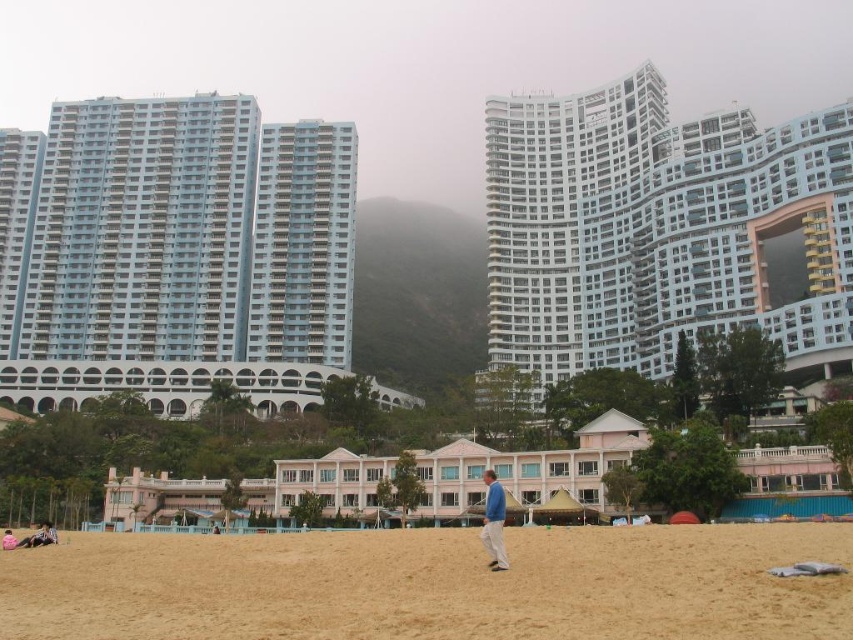
Is light blue glass building at left smaller than light blue fabric at lower left?

Actually, light blue glass building at left might be larger than light blue fabric at lower left.

Describe the element at coordinates (189, 236) in the screenshot. I see `light blue glass building at left` at that location.

Between point (129, 184) and point (4, 541), which one is positioned behind?

The point (129, 184) is more distant.

Where is `light blue glass building at left`? The image size is (853, 640). light blue glass building at left is located at coordinates (189, 236).

Is point (502, 531) closer to camera compared to point (30, 538)?

Yes, point (502, 531) is closer to viewer.

Is blue fabric jacket at center further to camera compared to matte black surfboard at lower left?

No, blue fabric jacket at center is in front of matte black surfboard at lower left.

Image resolution: width=853 pixels, height=640 pixels. Find the location of `blue fabric jacket at center`. blue fabric jacket at center is located at coordinates (492, 522).

Is white glass building at upper right to the right of blue fabric jacket at center from the viewer's perspective?

Correct, you'll find white glass building at upper right to the right of blue fabric jacket at center.

How much distance is there between white glass building at upper right and blue fabric jacket at center?

They are 171.20 feet apart.

Which is in front, point (805, 202) or point (492, 556)?

Positioned in front is point (492, 556).

At what (x,y) coordinates should I click in order to perform the action: click on white glass building at upper right. Please return your answer as a coordinate pair (x, y). The width and height of the screenshot is (853, 640). Looking at the image, I should click on (656, 227).